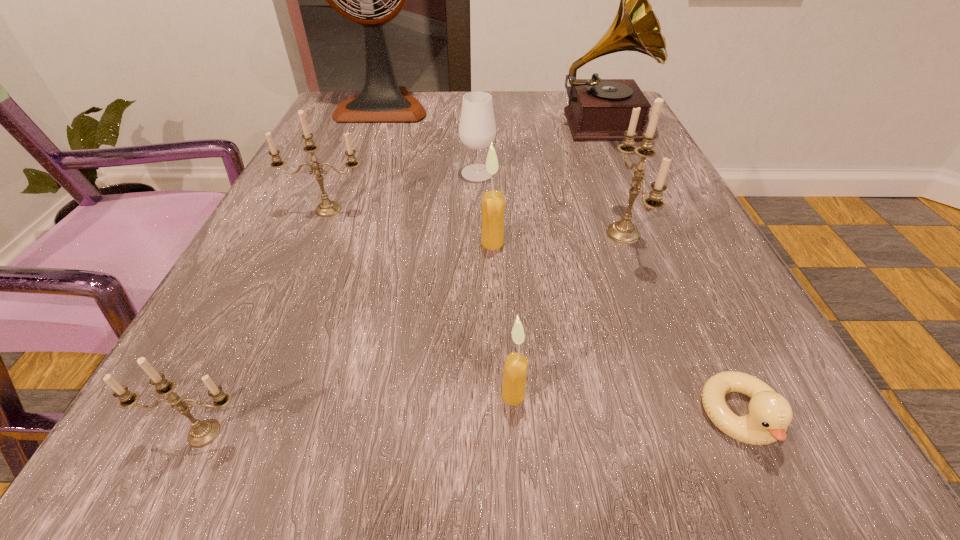
Where is `brown fan`? The image size is (960, 540). brown fan is located at coordinates click(x=381, y=100).

I want to click on fan, so click(x=381, y=100).

Locate an element on the screen. The image size is (960, 540). brown phonograph record is located at coordinates (599, 109).

The image size is (960, 540). Find the location of `the eighth shortest object`. the eighth shortest object is located at coordinates (599, 109).

Identify the location of the rightmost candle. This screenshot has width=960, height=540. (623, 231).

Image resolution: width=960 pixels, height=540 pixels. Find the location of `the biggest metallic candle`. the biggest metallic candle is located at coordinates (623, 231).

Image resolution: width=960 pixels, height=540 pixels. In order to click on the farther cream candle in this screenshot , I will do `click(493, 202)`.

Image resolution: width=960 pixels, height=540 pixels. Identify the location of the second smallest metallic candle. (327, 208).

You are a GUI agent. You are given a task and a screenshot of the screen. Output one action in this format:
    pyautogui.click(x=<x>, y=<y>)
    Task: Click on the third farthest object
    The height and width of the screenshot is (540, 960).
    Given the screenshot: What is the action you would take?
    pyautogui.click(x=477, y=129)

You are a GUI agent. You are given a task and a screenshot of the screen. Output one action in this format:
    pyautogui.click(x=<x>, y=<y>)
    Task: Click on the fourth farthest candle
    
    Given the screenshot: What is the action you would take?
    pyautogui.click(x=515, y=367)